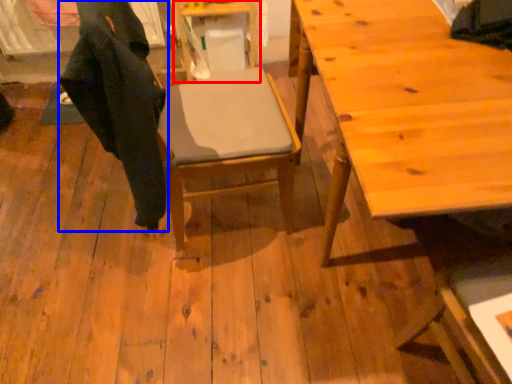
Question: Among these objects, which one is farthest to the camera, table (highlighted by a red box) or robe (highlighted by a blue box)?

Choices:
 (A) table
 (B) robe

Answer: (A)